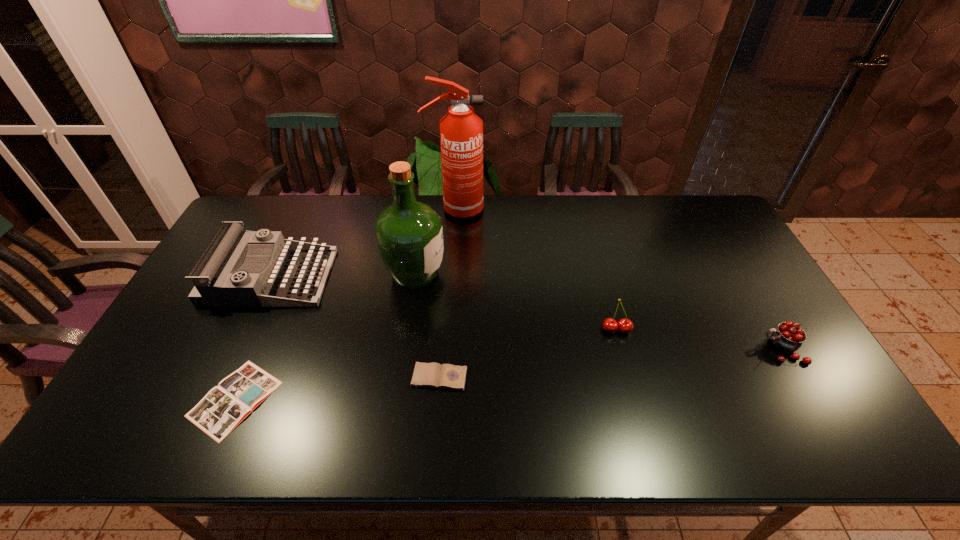
In order to click on free spot that satisfies the following two spatial constraints: 1. on the back side of the second shortest object; 2. on the front-facing side of the second tallest object in this screenshot , I will do `click(447, 274)`.

Image resolution: width=960 pixels, height=540 pixels. What are the coordinates of `vacant space that satisfies the following two spatial constraints: 1. on the typing side of the diary; 2. on the left side of the typewriter` in the screenshot? It's located at (223, 377).

At what (x,y) coordinates should I click in order to perform the action: click on vacant point that satisfies the following two spatial constraints: 1. on the typing side of the typewriter; 2. on the back side of the shortest object. Please return your answer as a coordinate pair (x, y). This screenshot has height=540, width=960. Looking at the image, I should click on coord(212,399).

You are a GUI agent. You are given a task and a screenshot of the screen. Output one action in this format:
    pyautogui.click(x=<x>, y=<y>)
    Task: Click on the free space in the image that satisfies the following two spatial constraints: 1. on the handle side of the right cherry; 2. at the nozzle of the fire extinguisher
    This screenshot has width=960, height=540.
    Given the screenshot: What is the action you would take?
    pyautogui.click(x=700, y=210)

Identify the location of free spot that satisfies the following two spatial constraints: 1. at the nozzle of the farthest object; 2. on the handle side of the right cherry. This screenshot has height=540, width=960. (446, 349).

Identify the location of free space that satisfies the following two spatial constraints: 1. on the typing side of the typewriter; 2. on the left side of the second shortest object. This screenshot has width=960, height=540. (223, 377).

Identify the location of vacant area in the image that satisfies the following two spatial constraints: 1. with the stems of the sixth object from left to right pointing upwards; 2. on the handle side of the rightmost object. This screenshot has height=540, width=960. (622, 349).